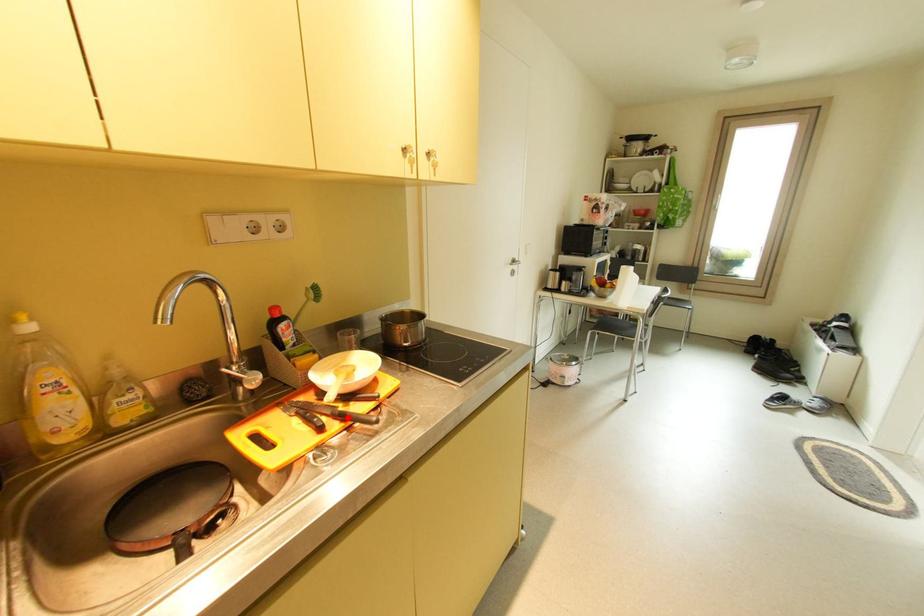
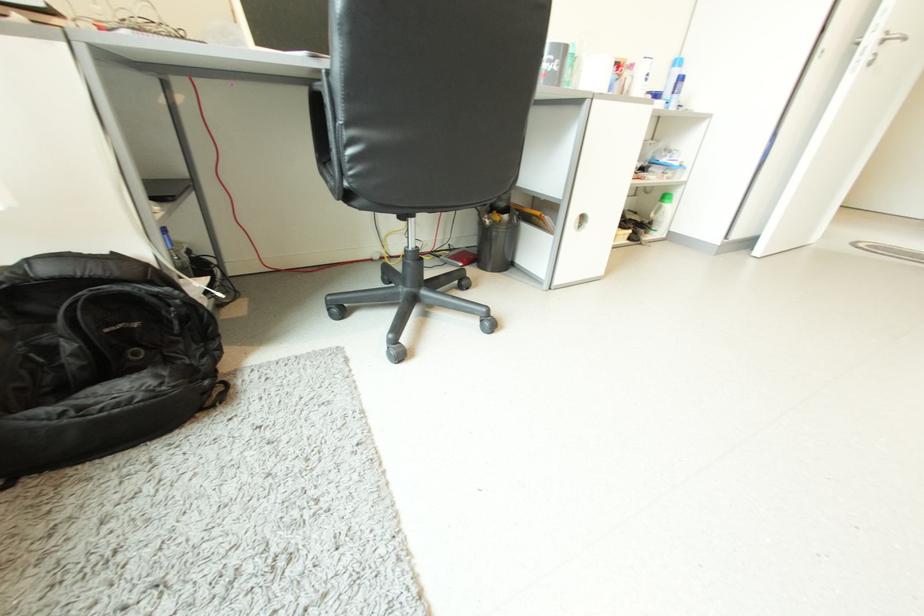
Question: I am providing you with two images of the same scene from different viewpoints. A red point is marked on the first image. Is the red point's position out of view in image 2?

Choices:
 (A) Yes
 (B) No

Answer: (A)